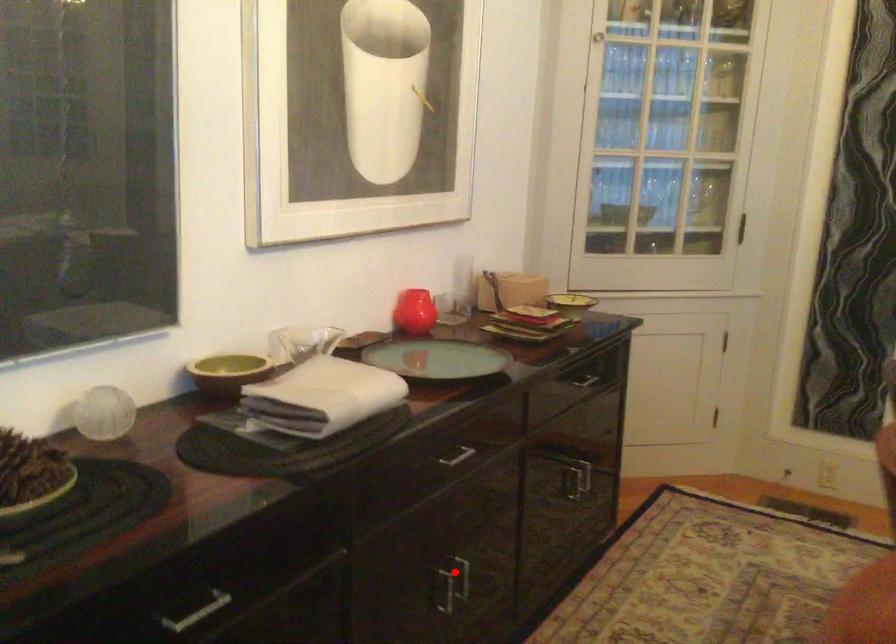
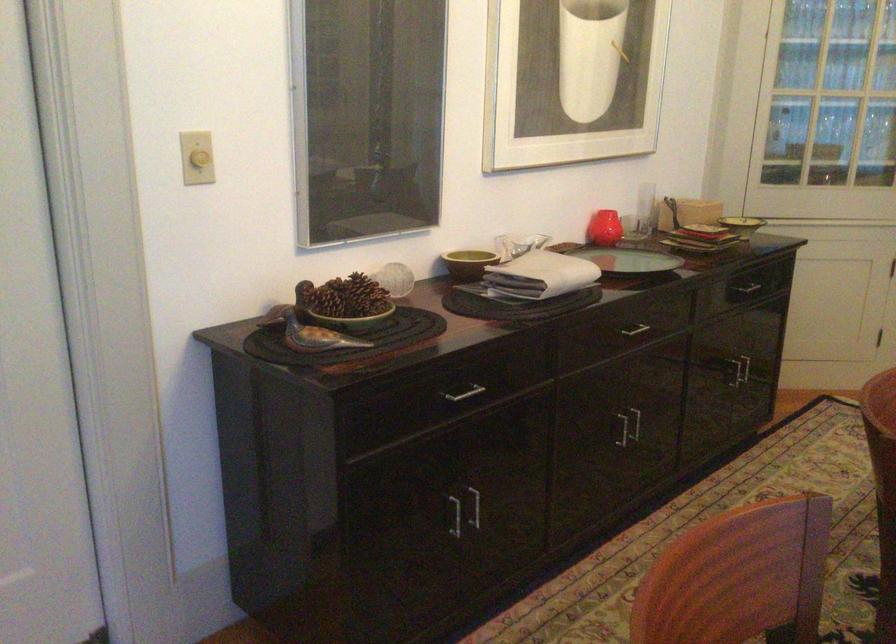
Question: I am providing you with two images of the same scene from different viewpoints. In image1, a red point is highlighted. Considering the same 3D point in image2, which of the following is correct?

Choices:
 (A) It is closer
 (B) It is farther

Answer: (B)